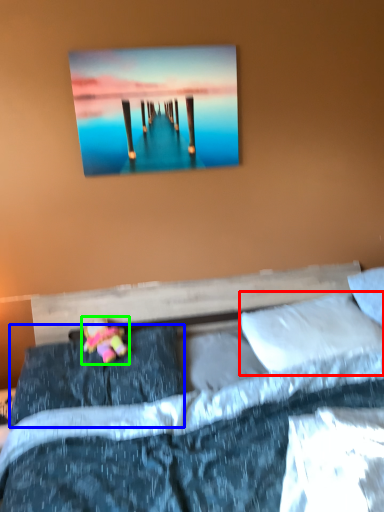
Question: Which is nearer to the pillow (highlighted by a red box)? pillow (highlighted by a blue box) or doll (highlighted by a green box).

Choices:
 (A) pillow
 (B) doll

Answer: (A)